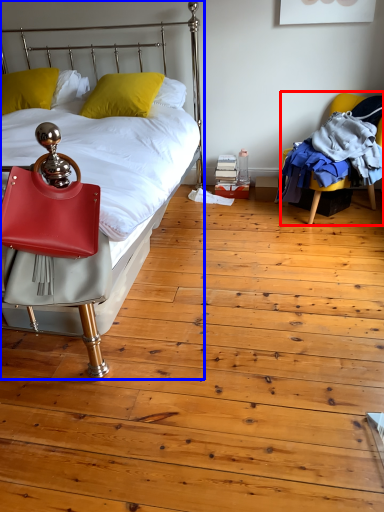
Question: Which object appears closest to the camera in this image, chair (highlighted by a red box) or bed (highlighted by a blue box)?

Choices:
 (A) chair
 (B) bed

Answer: (B)